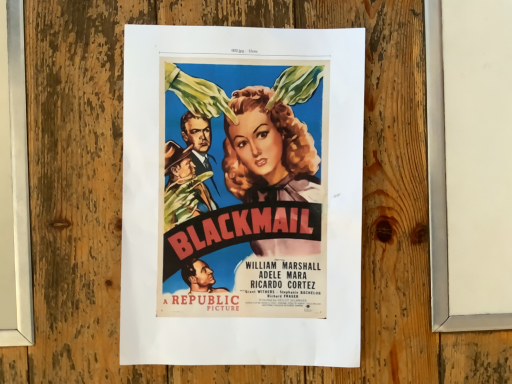
What is the approximate width of matte paper poster at center?

matte paper poster at center is 12.20 inches in width.

This screenshot has height=384, width=512. What do you see at coordinates (242, 196) in the screenshot?
I see `matte paper poster at center` at bounding box center [242, 196].

You are a GUI agent. You are given a task and a screenshot of the screen. Output one action in this format:
    pyautogui.click(x=<x>, y=<y>)
    Task: Click on the matte paper poster at center
    The image size is (512, 384).
    Given the screenshot: What is the action you would take?
    pyautogui.click(x=242, y=196)

You are a GUI agent. You are given a task and a screenshot of the screen. Output one action in this format:
    pyautogui.click(x=<x>, y=<y>)
    Task: Click on the matte paper poster at center
    
    Given the screenshot: What is the action you would take?
    pyautogui.click(x=242, y=196)